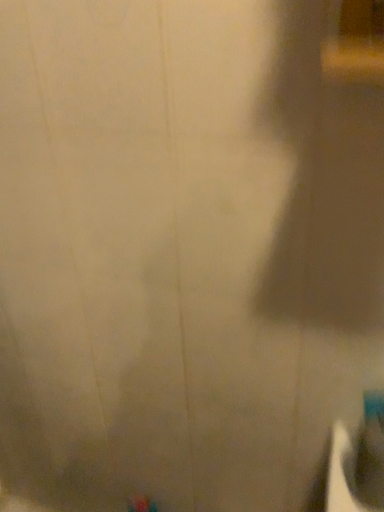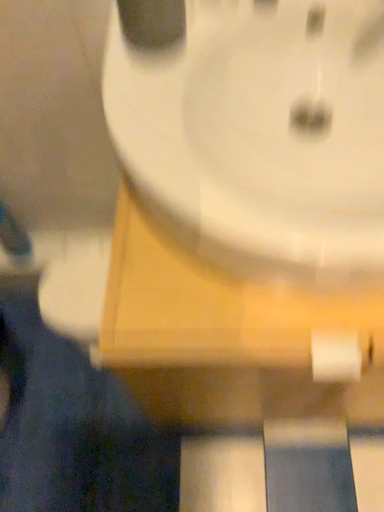
Question: Which way did the camera rotate in the video?

Choices:
 (A) rotated downward
 (B) rotated upward

Answer: (A)